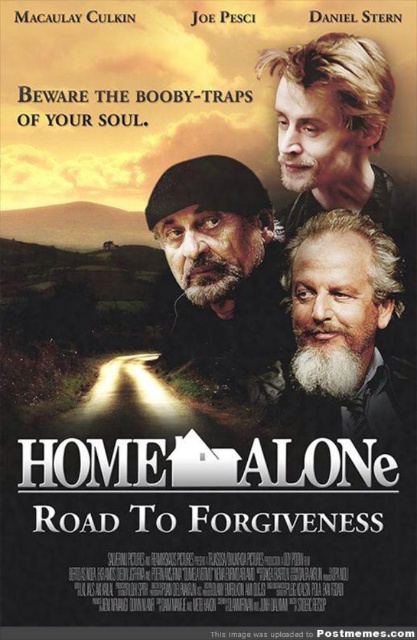
You are a moviegoer looking at the poster for Home Alone Road To Forgiveness. You notice two gray beards in the image. Which gray beard is positioned closer to the front of the poster, the gray beard at center or the gray beard at lower right?

The gray beard at center is closer to the viewer than gray beard at lower right.

Consider the image. You are a stunt coordinator planning a scene where two actors with gray beards need to cross a narrow bridge. The bridge is only 90 centimeters wide. Given the distance between the gray beard at center and gray beard at lower right in the poster, can both actors safely cross side by side without touching each other?

The gray beard at center and gray beard at lower right are 91.90 centimeters apart, which is slightly wider than the 90 centimeter bridge. Therefore, the two actors can safely cross side by side with a small amount of space between them.